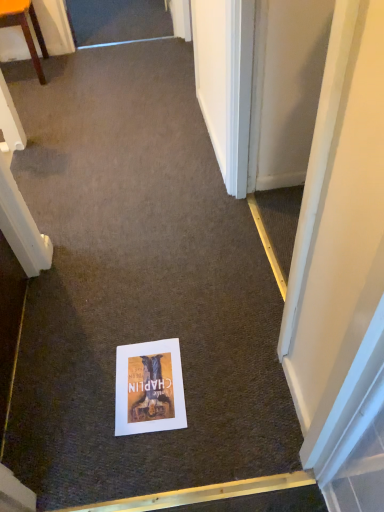
What do you see at coordinates (149, 388) in the screenshot? The height and width of the screenshot is (512, 384). I see `matte paper poster at center` at bounding box center [149, 388].

Locate an element on the screen. The width and height of the screenshot is (384, 512). matte paper poster at center is located at coordinates (149, 388).

Measure the distance between point (24, 17) and camera.

Point (24, 17) is 2.45 meters from camera.

Where is `wooden chair at upper left`? The width and height of the screenshot is (384, 512). wooden chair at upper left is located at coordinates (25, 28).

The image size is (384, 512). What do you see at coordinates (25, 28) in the screenshot?
I see `wooden chair at upper left` at bounding box center [25, 28].

In the scene shown: In order to face wooden chair at upper left, should I rotate leftwards or rightwards?

To align with it, rotate left about 22.151°.

What is the approximate height of wooden chair at upper left?

It is 18.79 inches.

Locate an element on the screen. matte paper poster at center is located at coordinates (149, 388).

In the image, is wooden chair at upper left on the left side or the right side of matte paper poster at center?

wooden chair at upper left is positioned on matte paper poster at center's left side.

Which object is closer to the camera, wooden chair at upper left or matte paper poster at center?

matte paper poster at center.

Which point is more distant from viewer, (16,24) or (164,382)?

The point (16,24) is farther.

From the image's perspective, relative to matte paper poster at center, is wooden chair at upper left above or below?

wooden chair at upper left is situated higher than matte paper poster at center in the image.

From a real-world perspective, is wooden chair at upper left located higher than matte paper poster at center?

Indeed, from a real-world perspective, wooden chair at upper left stands above matte paper poster at center.

Which object is wider, wooden chair at upper left or matte paper poster at center?

Wider between the two is wooden chair at upper left.

Can you confirm if wooden chair at upper left is shorter than matte paper poster at center?

No, wooden chair at upper left is not shorter than matte paper poster at center.

Does wooden chair at upper left have a smaller size compared to matte paper poster at center?

No.

Is matte paper poster at center completely or partially inside wooden chair at upper left?

No, matte paper poster at center is not inside wooden chair at upper left.

Are wooden chair at upper left and matte paper poster at center located far from each other?

That's right, there is a large distance between wooden chair at upper left and matte paper poster at center.

Is wooden chair at upper left oriented towards matte paper poster at center?

Yes, wooden chair at upper left is aimed at matte paper poster at center.

Can you tell me how much wooden chair at upper left and matte paper poster at center differ in facing direction?

wooden chair at upper left and matte paper poster at center are facing 178 degrees away from each other.

You are a GUI agent. You are given a task and a screenshot of the screen. Output one action in this format:
    pyautogui.click(x=<x>, y=<y>)
    Task: Click on the furniture above the matte paper poster at center (from the image's perspective)
    Image resolution: width=384 pixels, height=512 pixels.
    Given the screenshot: What is the action you would take?
    pyautogui.click(x=25, y=28)

In the image, is matte paper poster at center on the left side or the right side of wooden chair at upper left?

Clearly, matte paper poster at center is on the right of wooden chair at upper left in the image.

Is matte paper poster at center in front of or behind wooden chair at upper left in the image?

Visually, matte paper poster at center is located in front of wooden chair at upper left.

Which is nearer, (122, 384) or (35, 66)?

The point (122, 384) is closer to the camera.

From the image's perspective, relative to wooden chair at upper left, is matte paper poster at center above or below?

Clearly, from the image's perspective, matte paper poster at center is below wooden chair at upper left.

From a real-world perspective, is matte paper poster at center below wooden chair at upper left?

Yes, from a real-world perspective, matte paper poster at center is under wooden chair at upper left.

Can you confirm if matte paper poster at center is wider than wooden chair at upper left?

No, matte paper poster at center is not wider than wooden chair at upper left.

From their relative heights in the image, would you say matte paper poster at center is taller or shorter than wooden chair at upper left?

matte paper poster at center is shorter than wooden chair at upper left.

Based on their sizes in the image, would you say matte paper poster at center is bigger or smaller than wooden chair at upper left?

matte paper poster at center is smaller than wooden chair at upper left.

Is wooden chair at upper left surrounded by matte paper poster at center?

Definitely not — wooden chair at upper left is not inside matte paper poster at center.

Is matte paper poster at center beside wooden chair at upper left?

No, matte paper poster at center is not in contact with wooden chair at upper left.

From the picture: Does matte paper poster at center turn towards wooden chair at upper left?

No, matte paper poster at center is not turned towards wooden chair at upper left.

How many degrees apart are the facing directions of matte paper poster at center and wooden chair at upper left?

The angle between the facing direction of matte paper poster at center and the facing direction of wooden chair at upper left is 178 degrees.

I want to click on poster page that is under the wooden chair at upper left (from a real-world perspective), so click(x=149, y=388).

You are a GUI agent. You are given a task and a screenshot of the screen. Output one action in this format:
    pyautogui.click(x=<x>, y=<y>)
    Task: Click on the furniture on the left of the matte paper poster at center
    The image size is (384, 512).
    Given the screenshot: What is the action you would take?
    pyautogui.click(x=25, y=28)

The image size is (384, 512). In order to click on poster page below the wooden chair at upper left (from a real-world perspective) in this screenshot , I will do `click(149, 388)`.